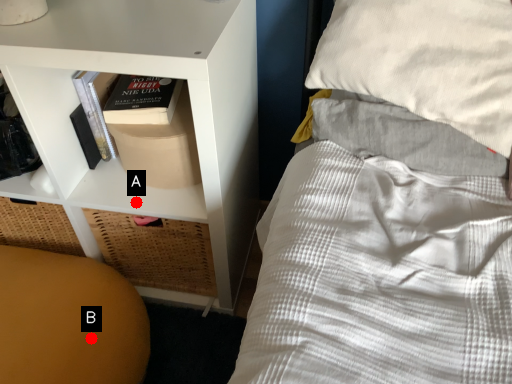
Question: Two points are circled on the image, labeled by A and B beside each circle. Which of the following is the closest to the observer?

Choices:
 (A) A is closer
 (B) B is closer

Answer: (B)